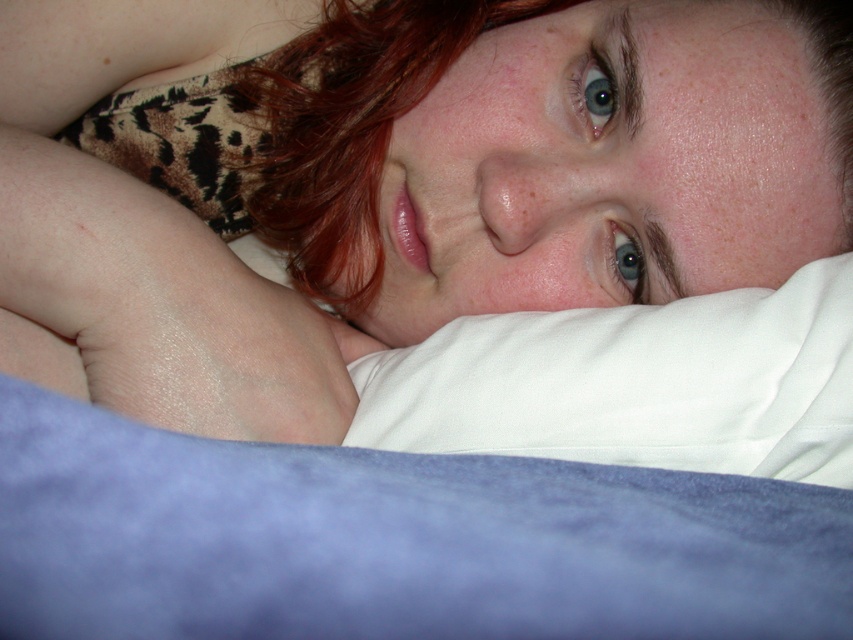
You are a photographer adjusting the lighting in the scene. You want to highlight the matte white pillow at upper center located at point (404, 184). Where should you position the light source to cast a shadow of the pillow towards the lower right corner?

To cast the shadow of the matte white pillow at upper center towards the lower right corner, position the light source above and to the left of the pillow.

You are a photographer setting up a shoot and need to place a small prop between the matte white pillow at upper center and the blue velvety sheet at lower center. Based on their positions, which object should the prop be placed closer to?

The prop should be placed closer to the blue velvety sheet at lower center because the matte white pillow at upper center is positioned on the left side of it, meaning the blue velvety sheet at lower center is to the right of the pillow.